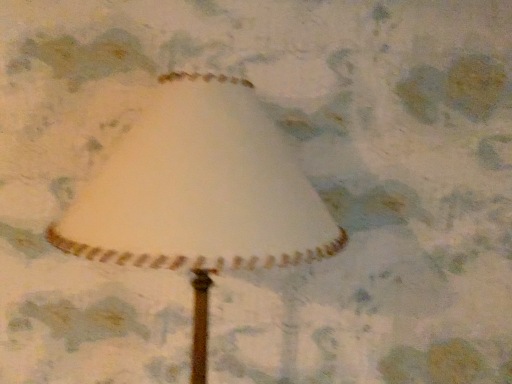
I want to click on matte white lampshade at center, so click(200, 195).

This screenshot has width=512, height=384. What do you see at coordinates (200, 195) in the screenshot? I see `matte white lampshade at center` at bounding box center [200, 195].

Where is `matte white lampshade at center`? Image resolution: width=512 pixels, height=384 pixels. matte white lampshade at center is located at coordinates (200, 195).